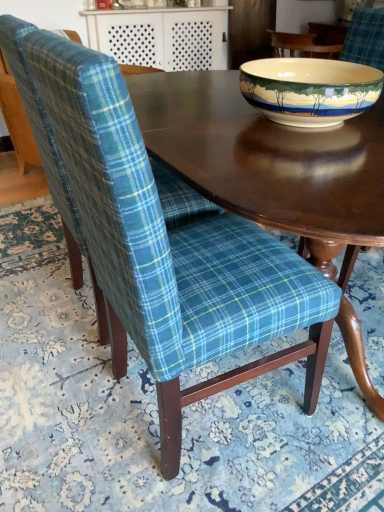
Question: From the image's perspective, is teal plaid fabric chair at center, the second chair in the back-to-front sequence, above porcelain bowl at upper right?

Choices:
 (A) no
 (B) yes

Answer: (A)

Question: Does teal plaid fabric chair at center, marked as the first chair in a front-to-back arrangement, lie in front of porcelain bowl at upper right?

Choices:
 (A) yes
 (B) no

Answer: (A)

Question: From a real-world perspective, is teal plaid fabric chair at center, marked as the first chair in a front-to-back arrangement, positioned under porcelain bowl at upper right based on gravity?

Choices:
 (A) no
 (B) yes

Answer: (B)

Question: Does teal plaid fabric chair at center, marked as the first chair in a front-to-back arrangement, have a lesser width compared to porcelain bowl at upper right?

Choices:
 (A) yes
 (B) no

Answer: (B)

Question: Considering the relative sizes of teal plaid fabric chair at center, marked as the first chair in a front-to-back arrangement, and porcelain bowl at upper right in the image provided, is teal plaid fabric chair at center, marked as the first chair in a front-to-back arrangement, taller than porcelain bowl at upper right?

Choices:
 (A) no
 (B) yes

Answer: (B)

Question: Based on their sizes in the image, would you say porcelain bowl at upper right is bigger or smaller than smooth dark wood table at upper center?

Choices:
 (A) big
 (B) small

Answer: (B)

Question: From the image's perspective, is porcelain bowl at upper right positioned above or below smooth dark wood table at upper center?

Choices:
 (A) above
 (B) below

Answer: (B)

Question: Is point (311, 102) positioned closer to the camera than point (190, 54)?

Choices:
 (A) farther
 (B) closer

Answer: (B)

Question: Based on their positions, is porcelain bowl at upper right located to the left or right of smooth dark wood table at upper center?

Choices:
 (A) right
 (B) left

Answer: (A)

Question: Is smooth dark wood table at upper center situated inside blue plaid fabric chair at left, the second chair positioned from the front, or outside?

Choices:
 (A) outside
 (B) inside

Answer: (A)

Question: In terms of width, does smooth dark wood table at upper center look wider or thinner when compared to blue plaid fabric chair at left, the second chair positioned from the front?

Choices:
 (A) thin
 (B) wide

Answer: (A)

Question: From a real-world perspective, is smooth dark wood table at upper center physically located above or below blue plaid fabric chair at left, the second chair positioned from the front?

Choices:
 (A) above
 (B) below

Answer: (A)

Question: From the image's perspective, is smooth dark wood table at upper center positioned above or below blue plaid fabric chair at left, the second chair positioned from the front?

Choices:
 (A) above
 (B) below

Answer: (A)

Question: Considering their positions, is blue plaid fabric chair at left, the 1th chair positioned from the back, located in front of or behind porcelain bowl at upper right?

Choices:
 (A) front
 (B) behind

Answer: (A)

Question: From a real-world perspective, is blue plaid fabric chair at left, the second chair positioned from the front, above or below porcelain bowl at upper right?

Choices:
 (A) above
 (B) below

Answer: (B)